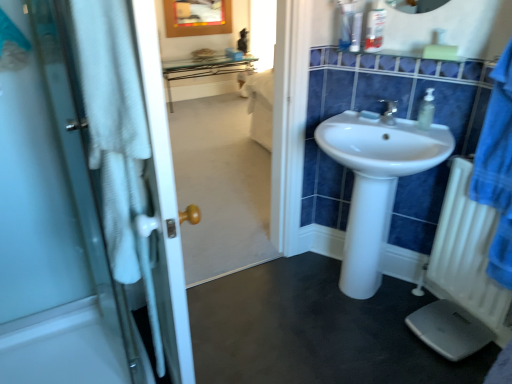
Find the location of a particular element. vacant space behind white plastic scale at lower right is located at coordinates (409, 296).